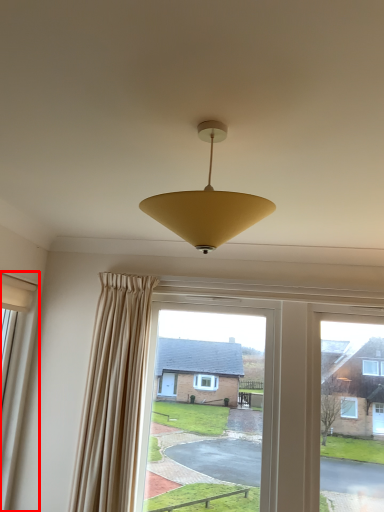
Question: From the image's perspective, what is the correct spatial relationship of window (annotated by the red box) in relation to lamp?

Choices:
 (A) above
 (B) below

Answer: (B)